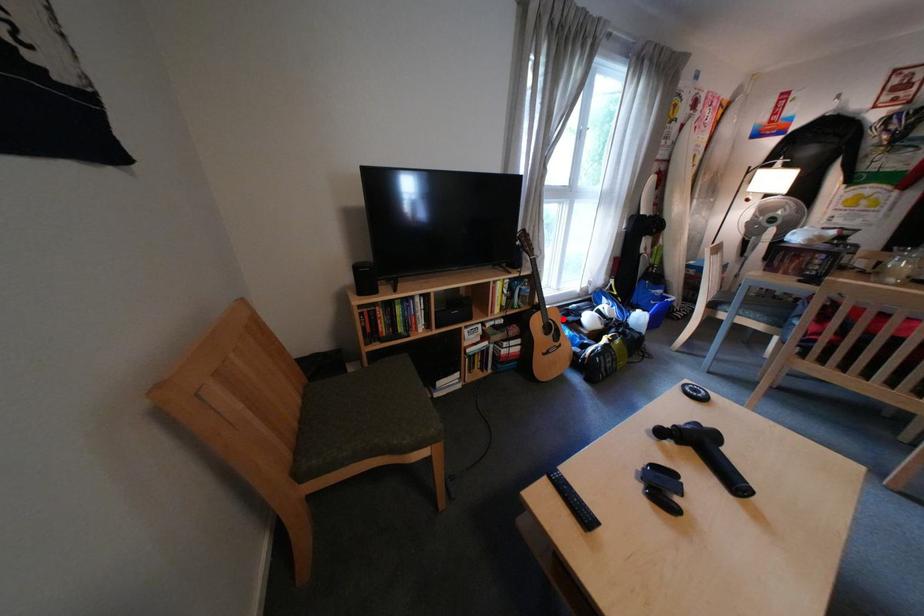
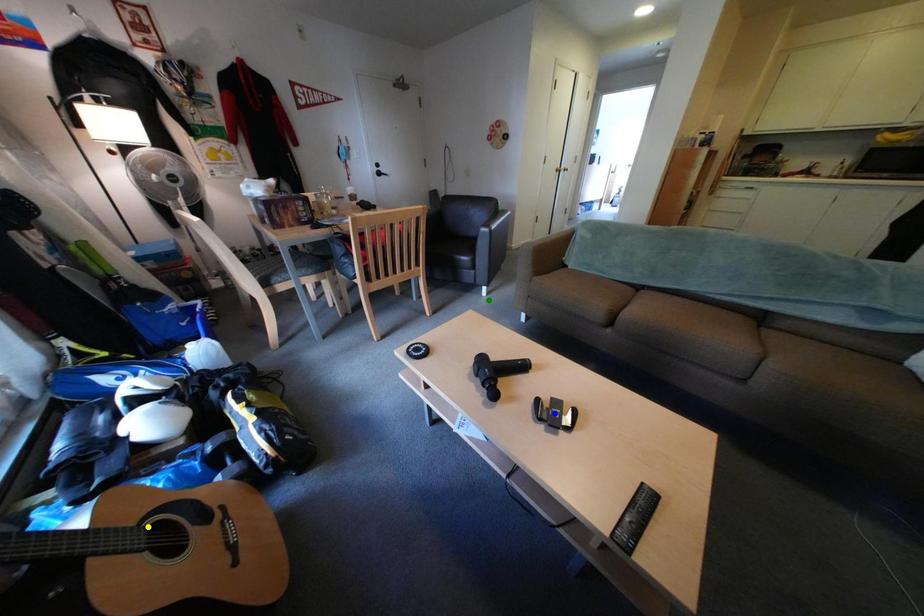
Question: I am providing you with two images of the same scene from different viewpoints. A red point is marked on the first image. You are given multiple points on the second image. Which point in image 2 represents the same 3d spot as the red point in image 1?

Choices:
 (A) green point
 (B) yellow point
 (C) blue point

Answer: (B)